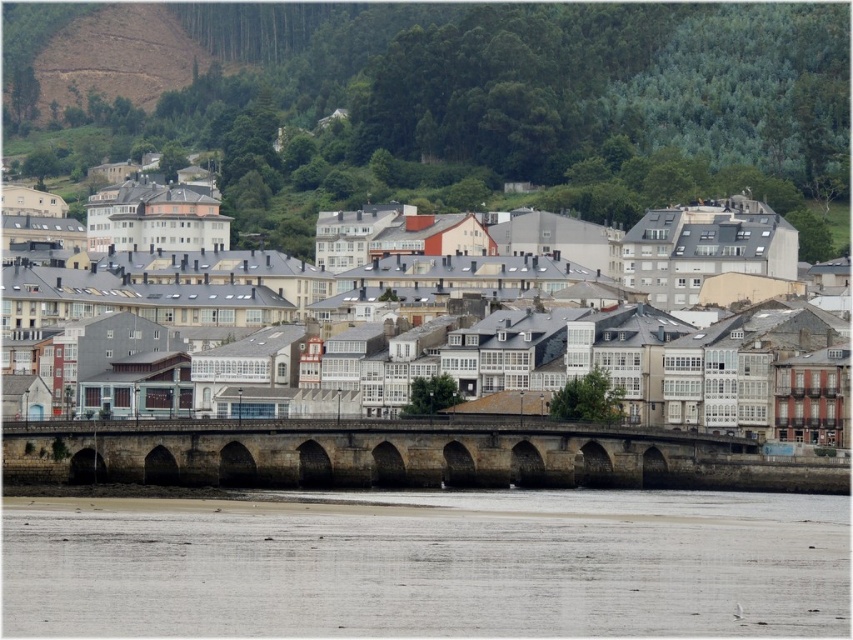
Does gray sand at lower center have a smaller size compared to white stone buildings at center?

Yes, gray sand at lower center is smaller than white stone buildings at center.

Is gray sand at lower center shorter than white stone buildings at center?

Indeed, gray sand at lower center has a lesser height compared to white stone buildings at center.

I want to click on gray sand at lower center, so click(x=428, y=564).

Image resolution: width=853 pixels, height=640 pixels. Find the location of `gray sand at lower center`. gray sand at lower center is located at coordinates (428, 564).

Is white stone buildings at center further to camera compared to stone arch bridge at center?

Yes, white stone buildings at center is further from the viewer.

Does point (57, 376) come farther from viewer compared to point (505, 436)?

Yes.

Describe the element at coordinates (315, 275) in the screenshot. The image size is (853, 640). I see `white stone buildings at center` at that location.

The width and height of the screenshot is (853, 640). What are the coordinates of `white stone buildings at center` in the screenshot? It's located at (315, 275).

Is point (241, 516) farther from viewer compared to point (215, 474)?

That is False.

Does gray sand at lower center have a lesser width compared to stone arch bridge at center?

No.

Locate an element on the screen. The width and height of the screenshot is (853, 640). gray sand at lower center is located at coordinates (428, 564).

The image size is (853, 640). Find the location of `gray sand at lower center`. gray sand at lower center is located at coordinates (428, 564).